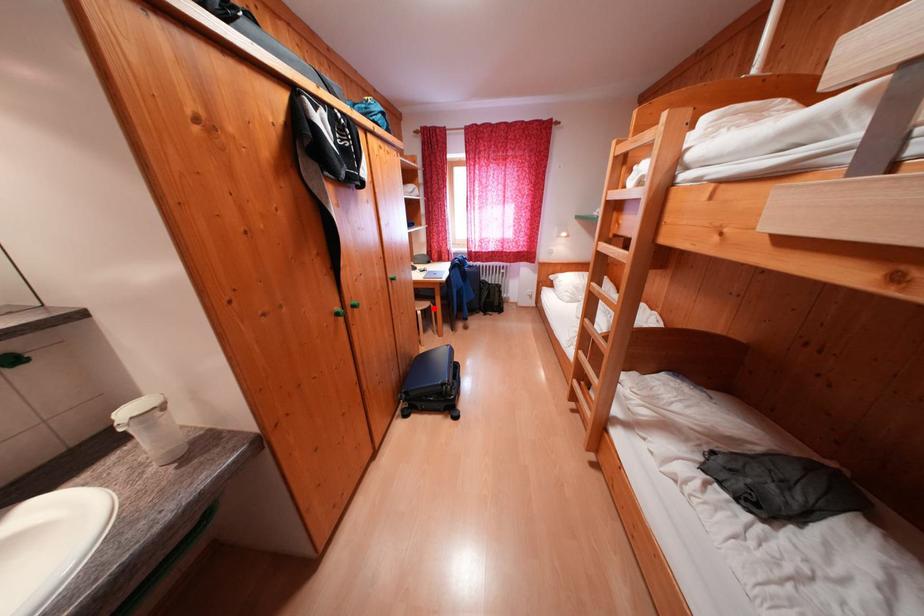
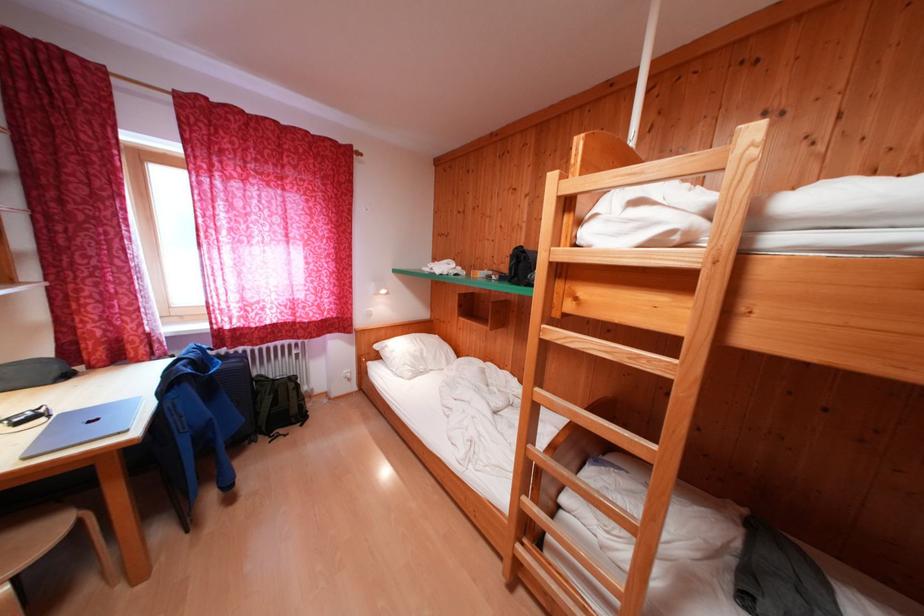
Where in the second image is the point corresponding to the highlighted location from the first image?

(55, 538)